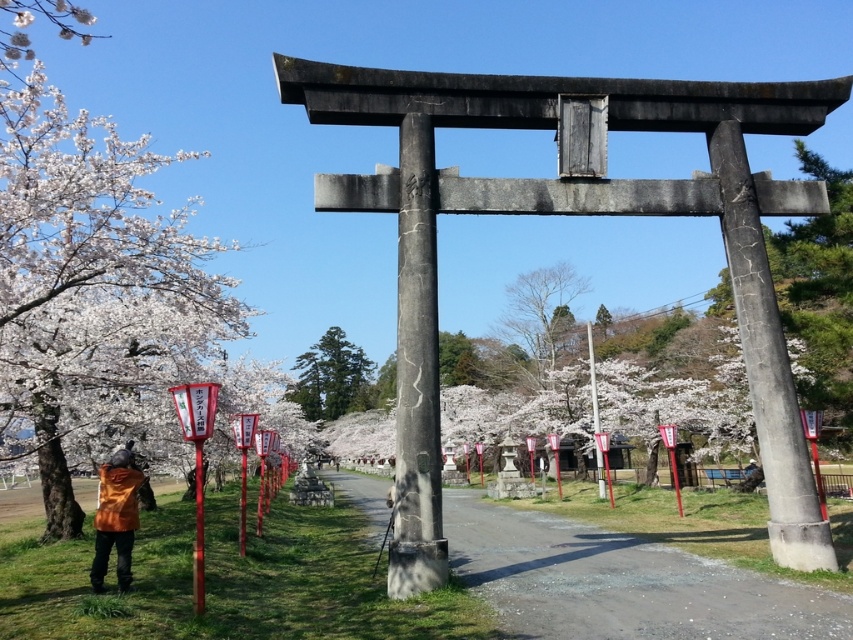
Is white blossoms at left bigger than dark gray stone pole at center?

Correct, white blossoms at left is larger in size than dark gray stone pole at center.

Does white blossoms at left appear on the left side of dark gray stone pole at center?

Yes, white blossoms at left is to the left of dark gray stone pole at center.

This screenshot has height=640, width=853. What are the coordinates of `white blossoms at left` in the screenshot? It's located at click(109, 250).

Is dark gray stone pole at center taller than bare wood tree at center?

No, dark gray stone pole at center is not taller than bare wood tree at center.

Does dark gray stone pole at center come behind bare wood tree at center?

No, it is in front of bare wood tree at center.

Which is behind, point (421, 394) or point (575, 276)?

The point (575, 276) is behind.

This screenshot has width=853, height=640. In order to click on dark gray stone pole at center in this screenshot , I will do `click(416, 372)`.

Based on the photo, does smooth gray stone torii gate at center have a smaller size compared to bare wood tree at center?

Incorrect, smooth gray stone torii gate at center is not smaller in size than bare wood tree at center.

Who is more distant from viewer, (842, 244) or (560, 264)?

Point (560, 264)

Measure the distance between point (824, 262) and camera.

Point (824, 262) is 11.45 meters away from camera.

The image size is (853, 640). I want to click on smooth gray stone torii gate at center, so click(x=819, y=296).